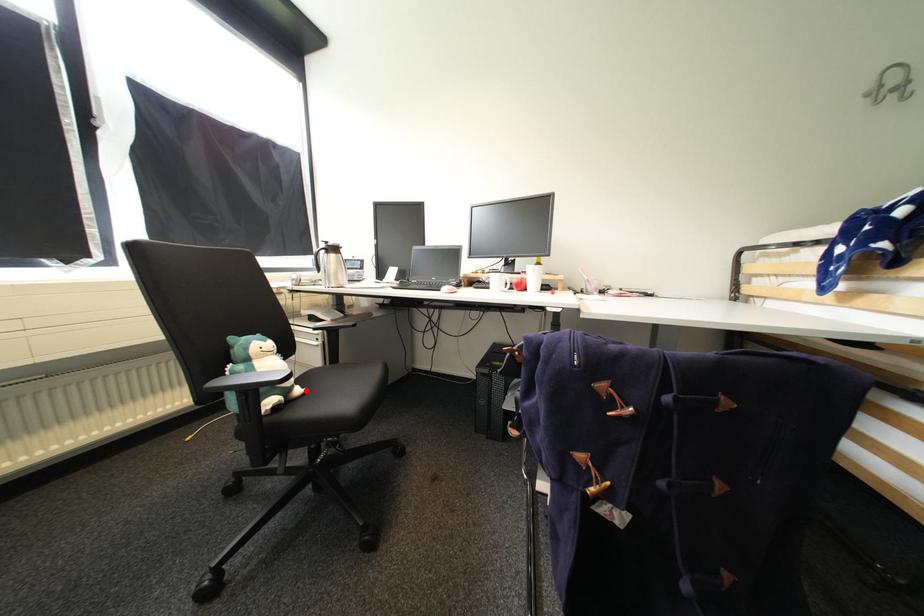
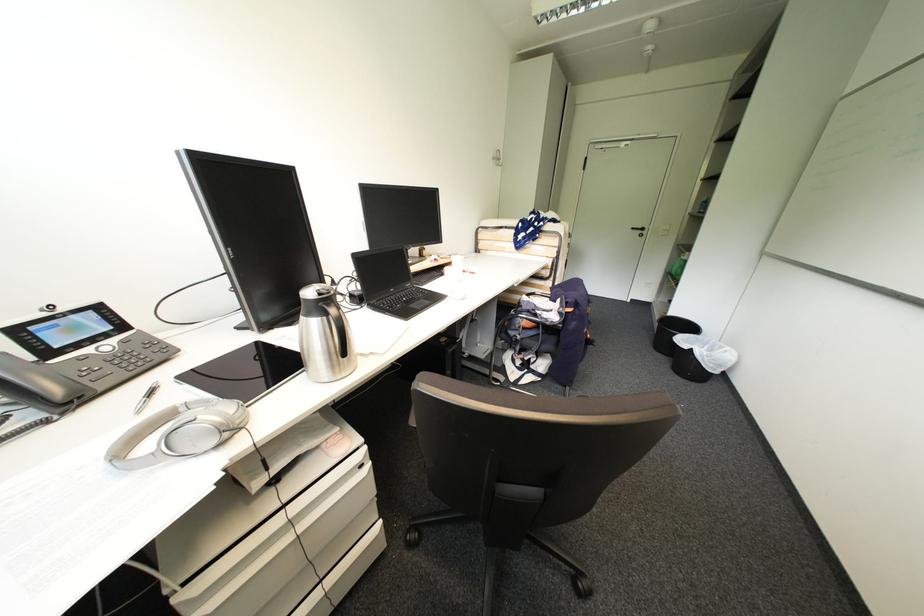
Question: I am providing you with two images of the same scene from different viewpoints. A red point is marked on the first image. Is the red point's position out of view in image 2?

Choices:
 (A) Yes
 (B) No

Answer: (A)